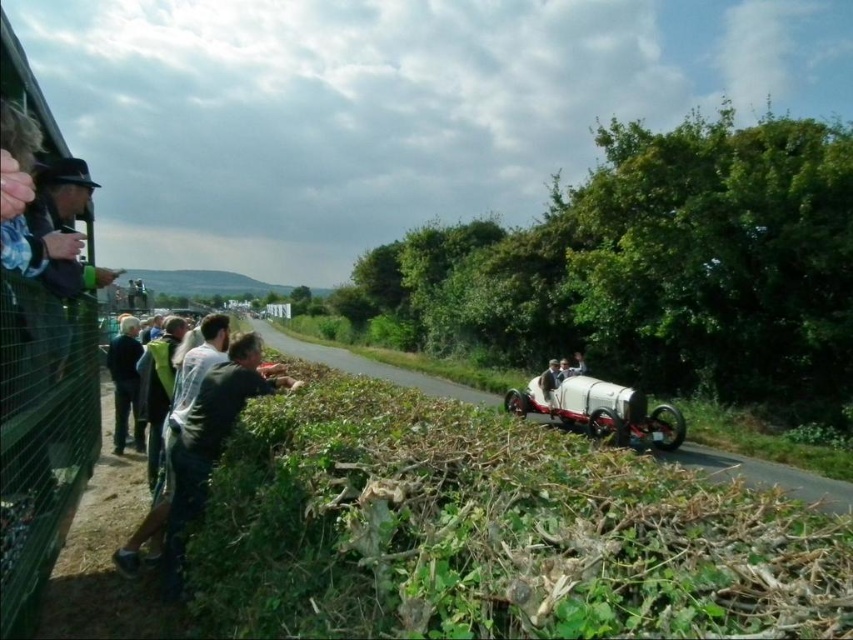
You are a photographer at the vintage car rally event. You want to take a photo that includes both the point at coordinates point (650,416) and point (120,337). Given their positions, which point should you focus on first to ensure both are in the frame?

You should focus on point (650,416) first because it is closer to you than point (120,337), ensuring both points are within the camera frame.